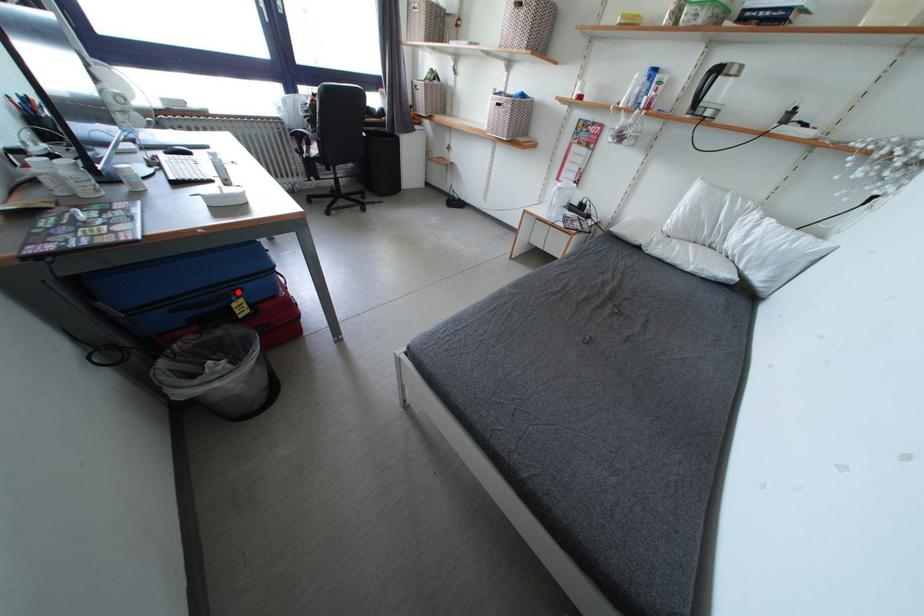
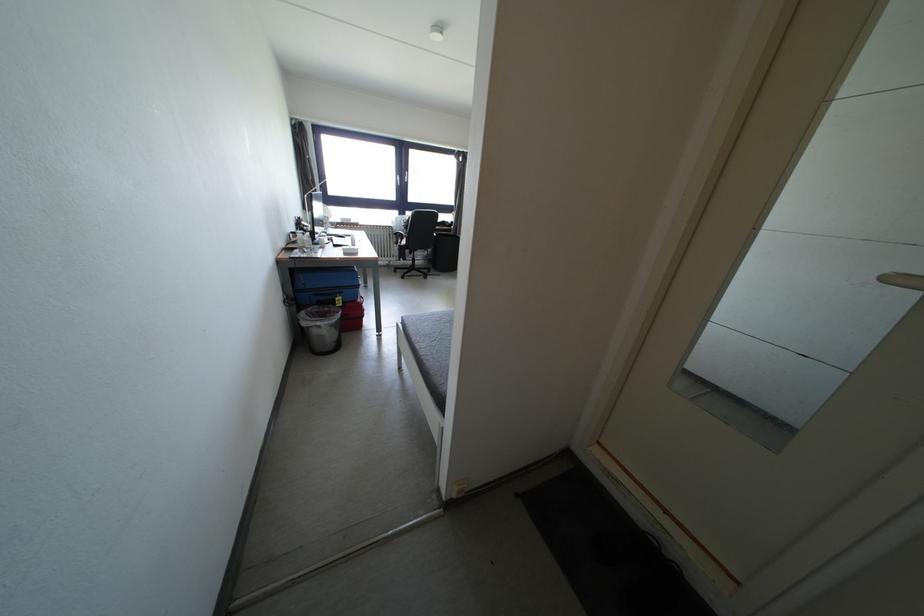
The point at the highlighted location is marked in the first image. Where is the corresponding point in the second image?

(345, 294)